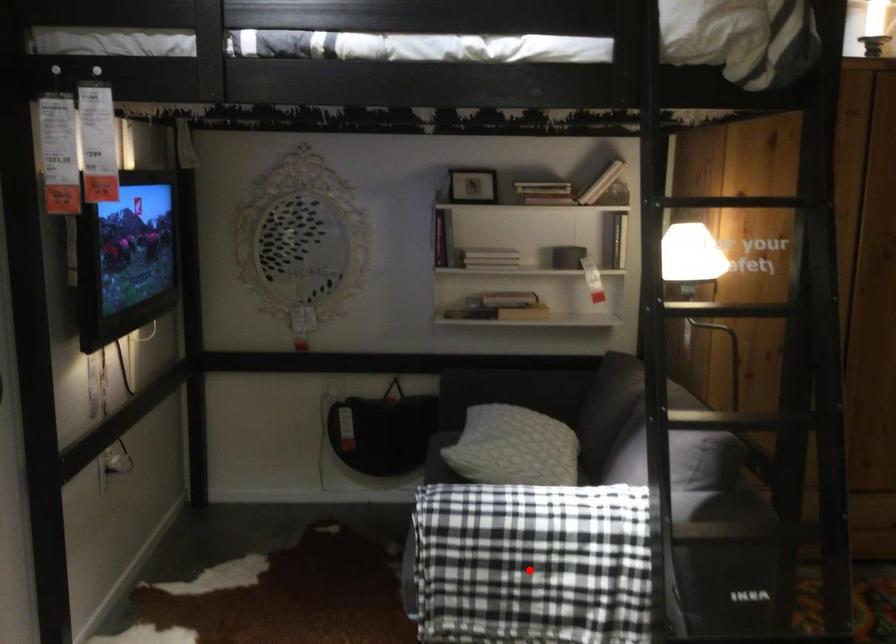
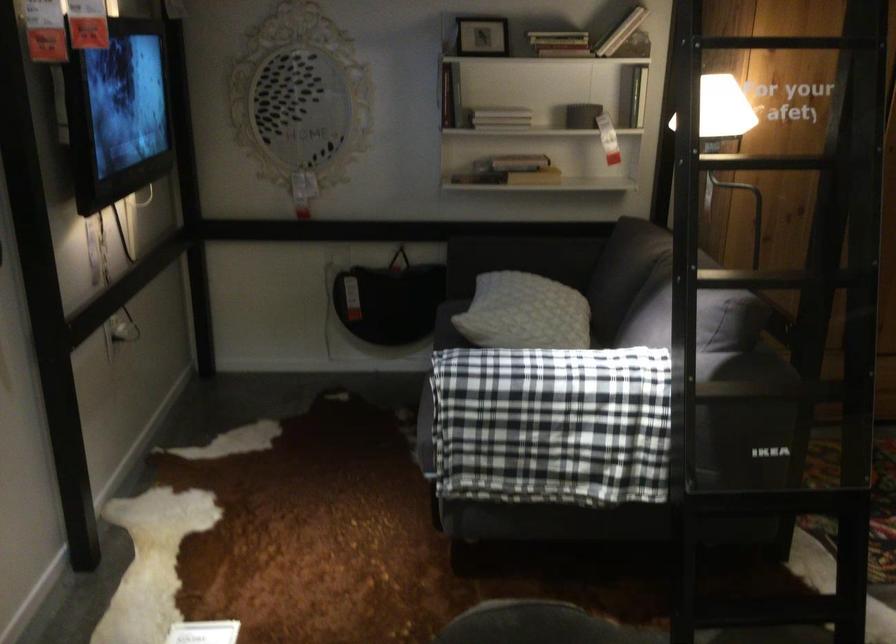
Find the pixel in the second image that matches the highlighted location in the first image.

(552, 424)